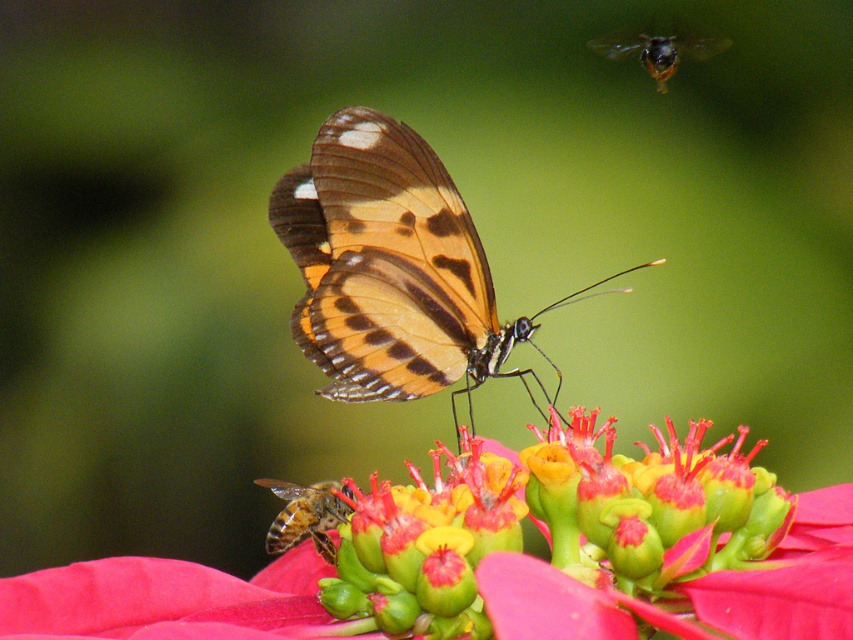
You are standing in front of the butterfly and flower scene. You notice two points marked in the image. Which of the two points, point (834, 497) or point (436, 179), is closer to you?

Point (834, 497) is closer to the camera than point (436, 179).

In the scene shown: You are standing at a point 6.24 feet away from the point marked at coordinates point (554, 305). If you want to move closer to this point, which direction should you move in relation to the butterfly and the poinsettia flower?

Since you are 6.24 feet away from point (554, 305) and want to move closer, you should move towards the direction of the butterfly and the poinsettia flower, as that point is where they are located.